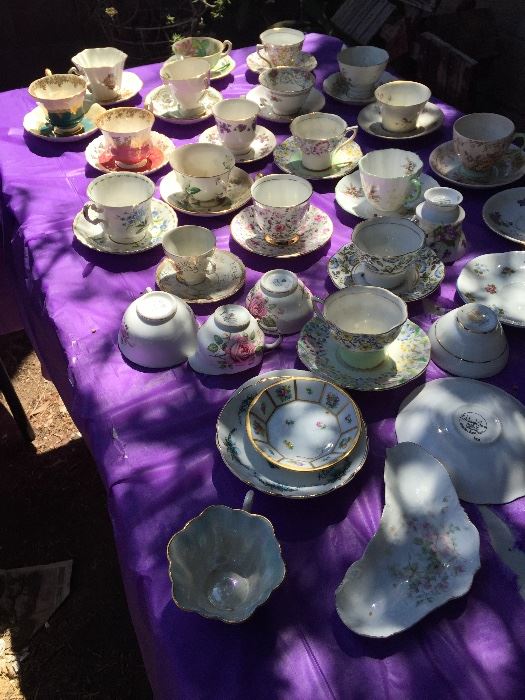
At what (x,y) coordinates should I click in order to perform the action: click on discarded newspaper. Please return your answer as a coordinate pair (x, y). Looking at the image, I should click on (47, 577).